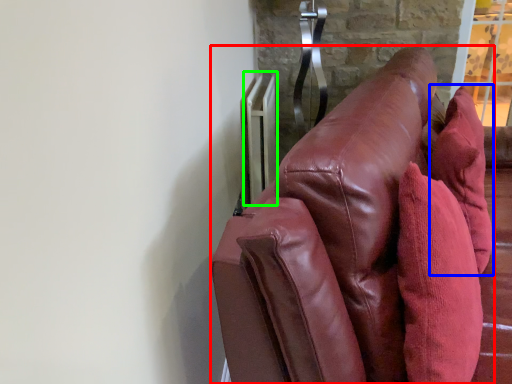
Question: Based on their relative distances, which object is farther from furniture (highlighted by a red box)? Choose from throw pillow (highlighted by a blue box) and radiator (highlighted by a green box).

Choices:
 (A) throw pillow
 (B) radiator

Answer: (B)